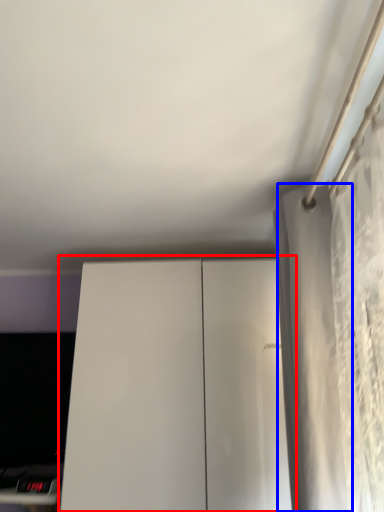
Question: Which of the following is the farthest to the observer, dresser (highlighted by a red box) or curtain (highlighted by a blue box)?

Choices:
 (A) dresser
 (B) curtain

Answer: (A)